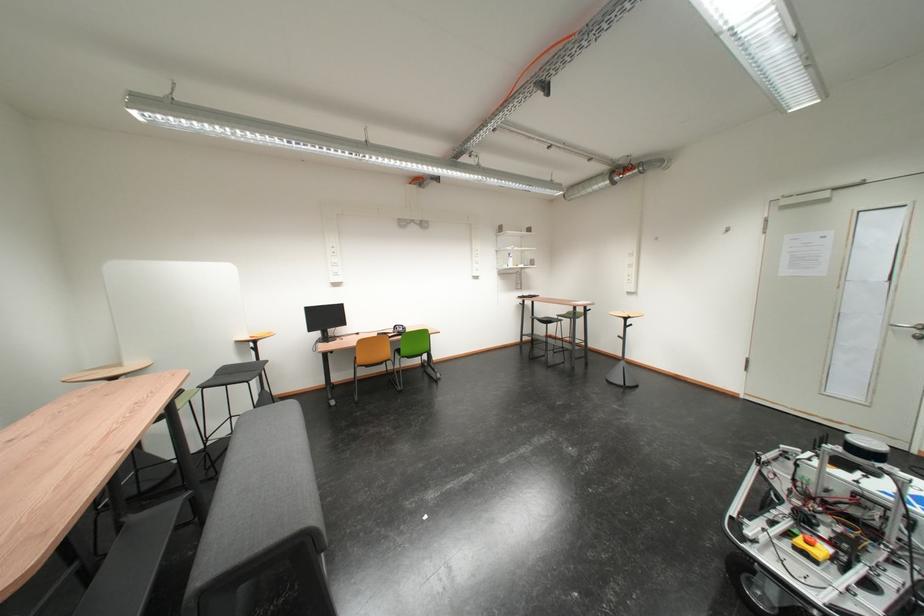
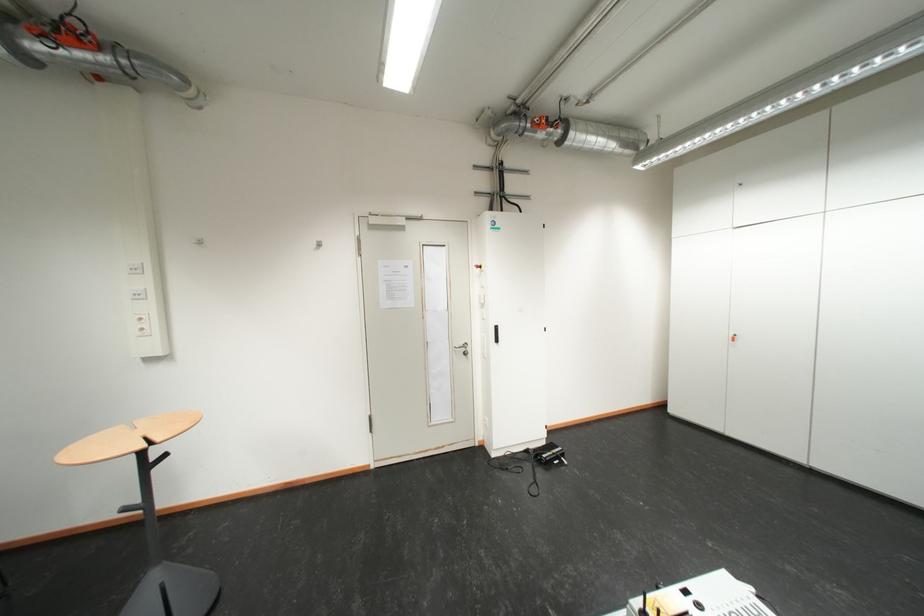
Find the pixel in the second image that matches point 625,185 in the first image.

(35, 60)